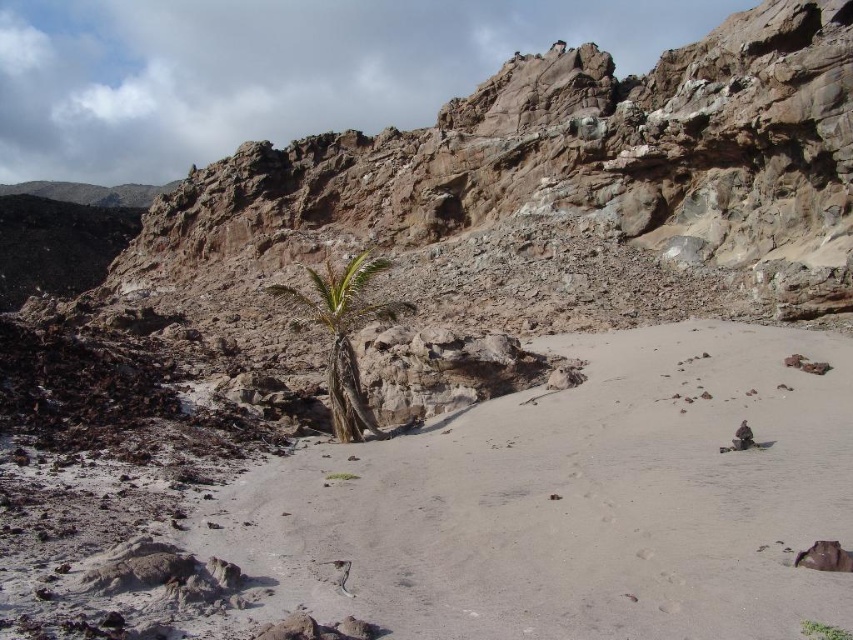
You are a hiker who wants to cross from the white sandy beach at center to the green leafy plant at center. Which direction should you move to reach the plant from the beach?

The white sandy beach at center is taller than the green leafy plant at center, so you should move downward to reach the green leafy plant at center from the beach.

You are standing on the white sandy beach at center and want to reach the green leafy palm tree at center. Which direction should you move to get closer to the palm tree?

The white sandy beach at center is in front of the green leafy palm tree at center, so to reach the palm tree, you should move backward away from the beach towards the tree.

You are standing in the arid landscape and want to walk from the point at coordinates point (329, 291) to the point at coordinates point (827, 637). Which direction should you face to move towards the destination?

You should face away from the camera because point (827, 637) is further away from the camera compared to point (329, 291).